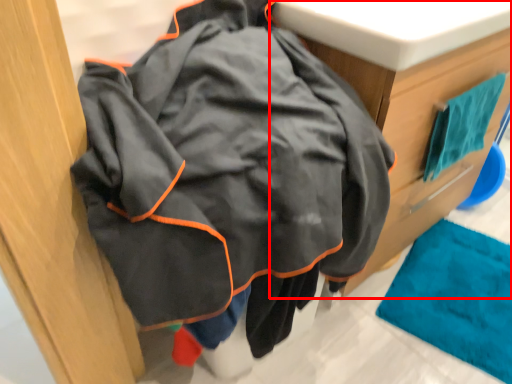
Question: Considering the relative positions of furniture (annotated by the red box) and bath towel in the image provided, where is furniture (annotated by the red box) located with respect to the staircase?

Choices:
 (A) left
 (B) right

Answer: (A)